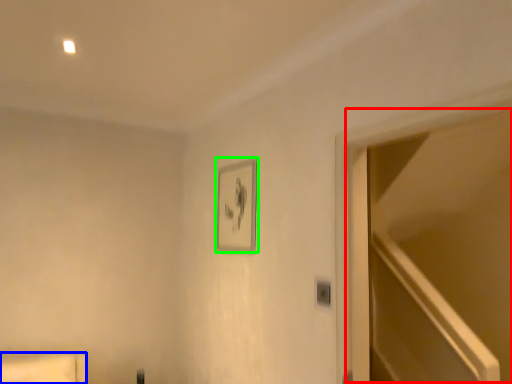
Question: Which is farther away from glass door (highlighted by a red box)? furniture (highlighted by a blue box) or picture frame (highlighted by a green box)?

Choices:
 (A) furniture
 (B) picture frame

Answer: (A)